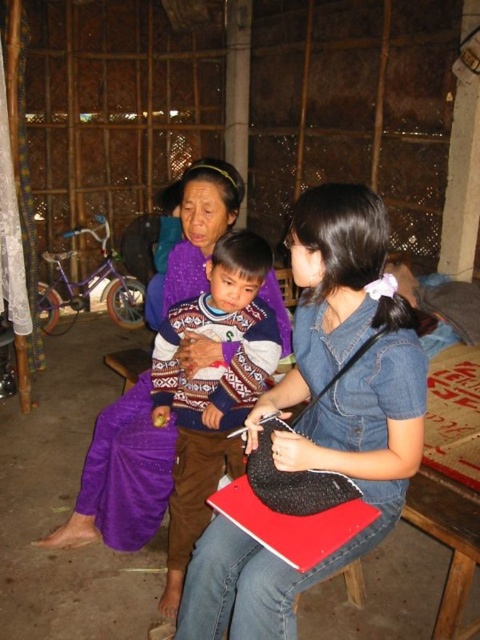
Question: Can you confirm if denim blue shirt at center is positioned below knitted sweater at center?

Choices:
 (A) yes
 (B) no

Answer: (B)

Question: Estimate the real-world distances between objects in this image. Which object is farther from the knitted sweater at center?

Choices:
 (A) denim blue shirt at center
 (B) purple woven fabric at center

Answer: (A)

Question: Which object is closer to the camera taking this photo?

Choices:
 (A) denim blue shirt at center
 (B) knitted sweater at center
 (C) purple woven fabric at center

Answer: (A)

Question: Which of the following is the farthest from the observer?

Choices:
 (A) purple woven fabric at center
 (B) knitted sweater at center

Answer: (A)

Question: Considering the relative positions of denim blue shirt at center and knitted sweater at center in the image provided, where is denim blue shirt at center located with respect to knitted sweater at center?

Choices:
 (A) below
 (B) above

Answer: (B)

Question: Observing the image, what is the correct spatial positioning of denim blue shirt at center in reference to knitted sweater at center?

Choices:
 (A) below
 (B) above

Answer: (B)